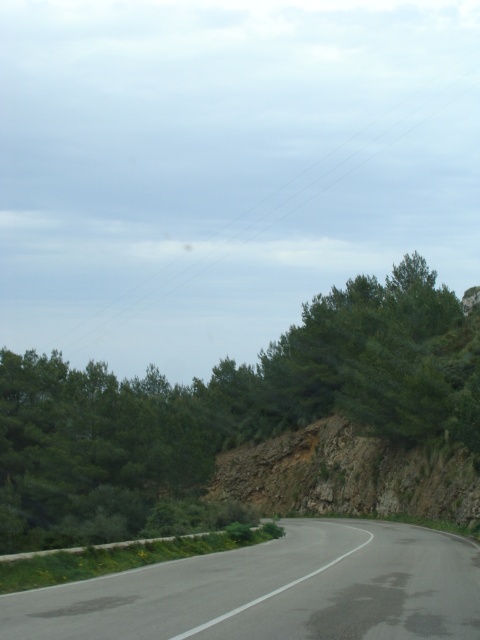
You are driving a car and see the green leafy tree at center and the black asphalt road at center ahead. Which object is closer to your current position?

The green leafy tree at center is closer to your current position because the black asphalt road at center is behind it.